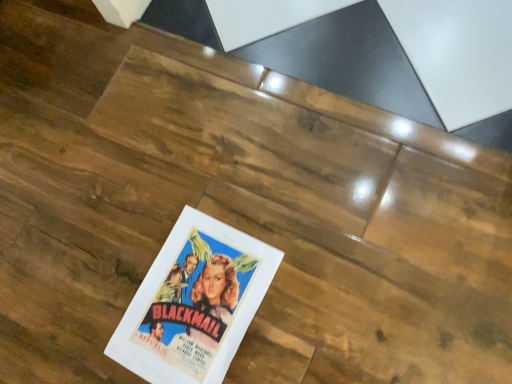
Describe the element at coordinates (194, 303) in the screenshot. I see `matte paper poster at center` at that location.

Where is `matte paper poster at center`? matte paper poster at center is located at coordinates (194, 303).

Locate an element on the screen. Image resolution: width=512 pixels, height=384 pixels. matte paper poster at center is located at coordinates (194, 303).